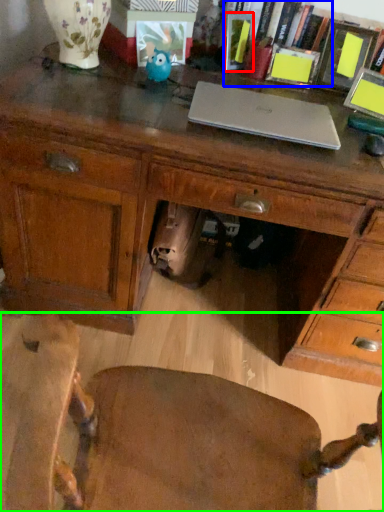
Question: Which object is the closest to the book (highlighted by a red box)? Choose among these: book (highlighted by a blue box) or chair (highlighted by a green box).

Choices:
 (A) book
 (B) chair

Answer: (A)